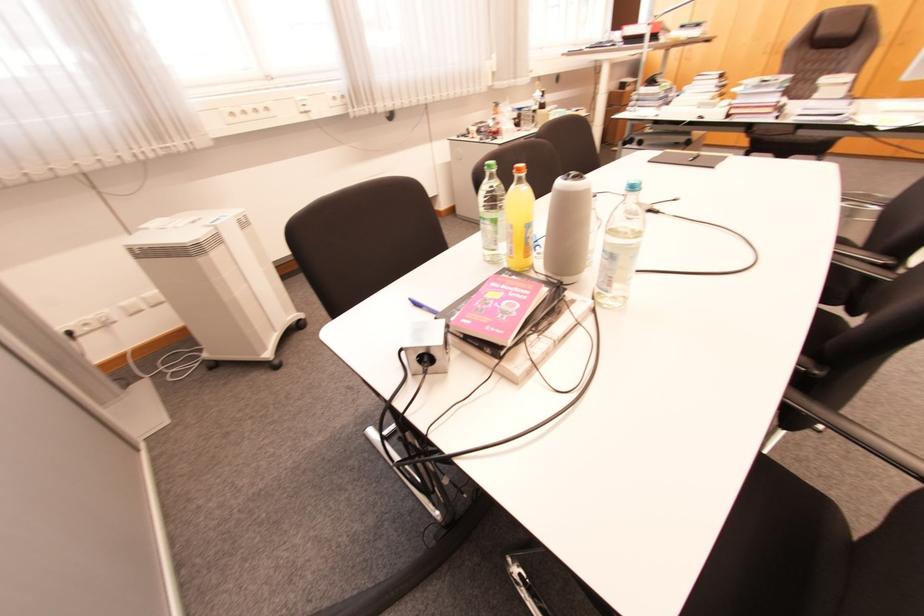
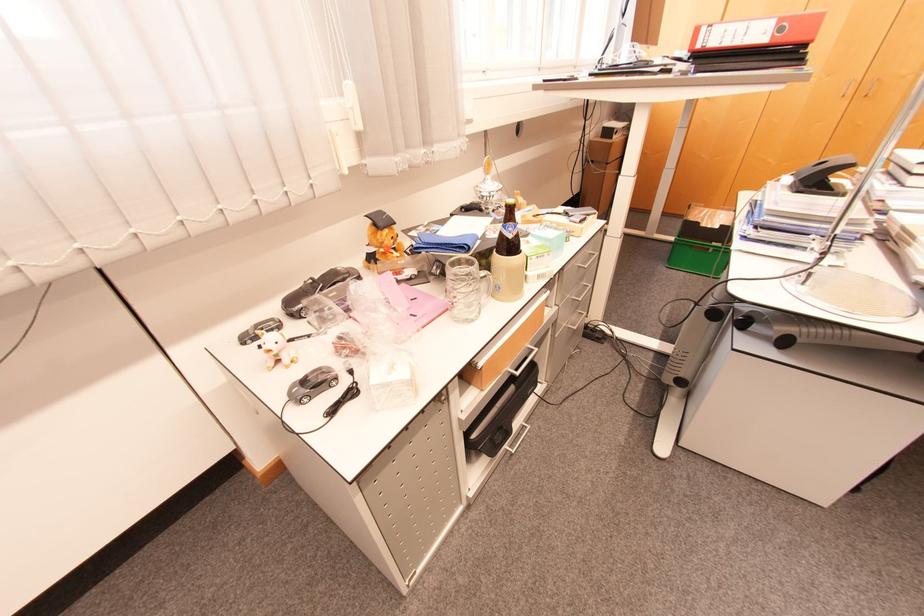
Question: In a continuous first-person perspective shot, in which direction is the camera moving?

Choices:
 (A) Left
 (B) Right
 (C) Forward
 (D) Backward

Answer: (C)